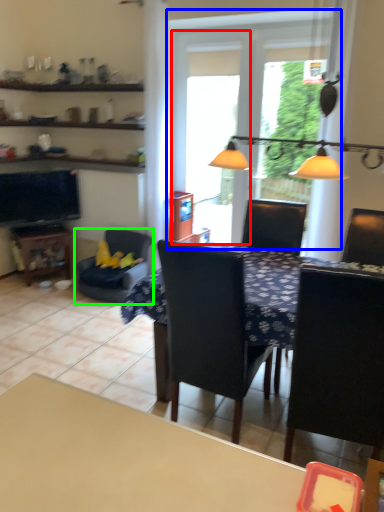
Question: Considering the real-world distances, which object is closest to screen door (highlighted by a red box)? window (highlighted by a blue box) or chair (highlighted by a green box).

Choices:
 (A) window
 (B) chair

Answer: (A)